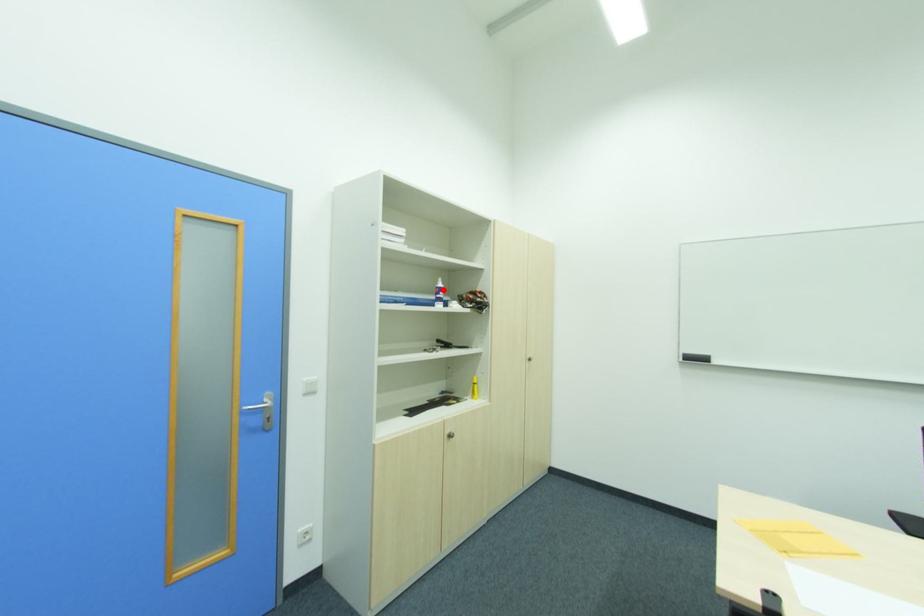
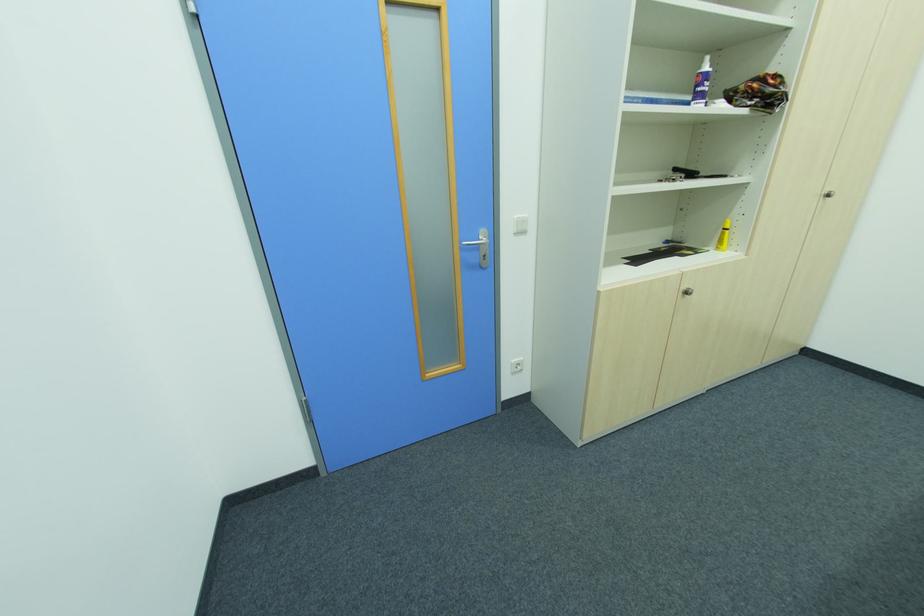
Find the pixel in the second image that matches the highlighted location in the first image.

(708, 78)